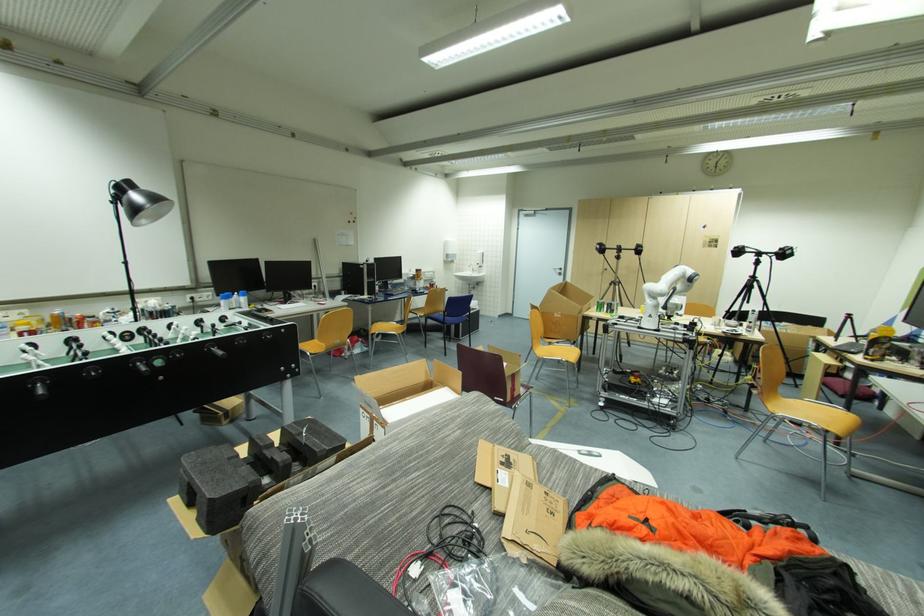
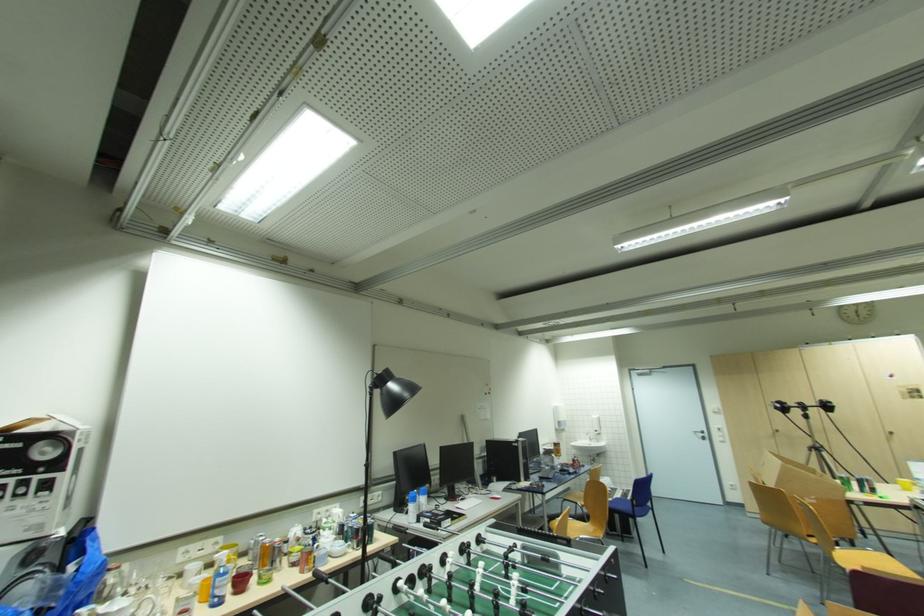
Find the pixel in the second image that matches [563,272] in the first image.

(706, 436)